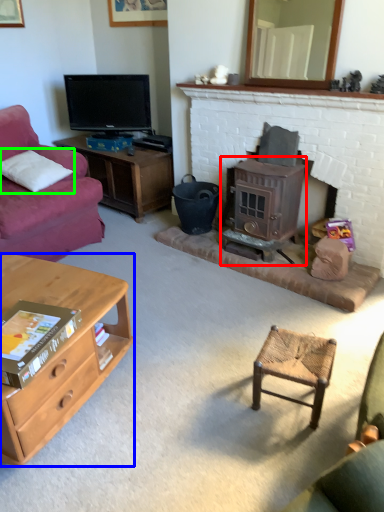
Question: Based on their relative distances, which object is nearer to wood burning stove (highlighted by a red box)? Choose from desk (highlighted by a blue box) and pillow (highlighted by a green box).

Choices:
 (A) desk
 (B) pillow

Answer: (A)